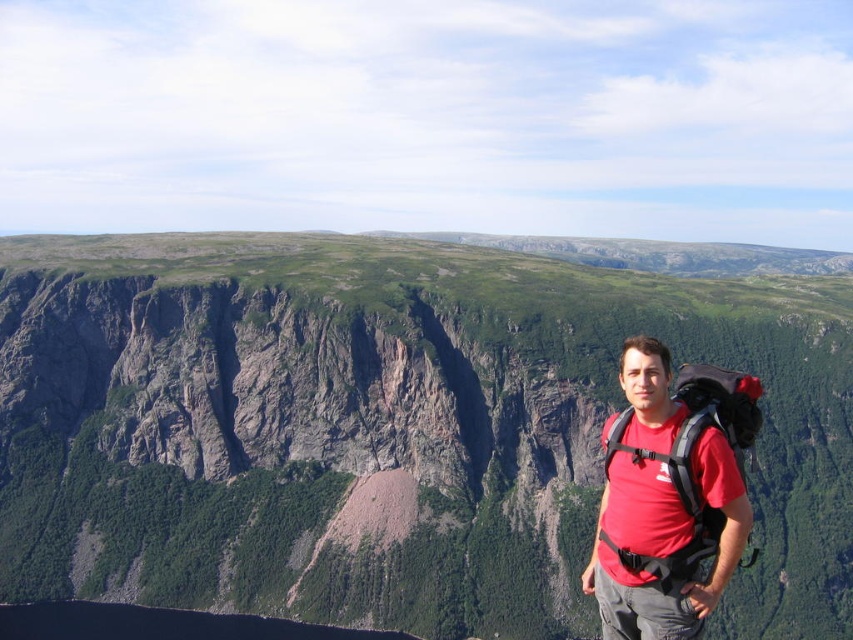
Locate an element on the screen. Image resolution: width=853 pixels, height=640 pixels. green rock cliff at center is located at coordinates (390, 426).

Does point (415, 250) lie behind point (698, 408)?

Yes.

Where is `green rock cliff at center`? The width and height of the screenshot is (853, 640). green rock cliff at center is located at coordinates (390, 426).